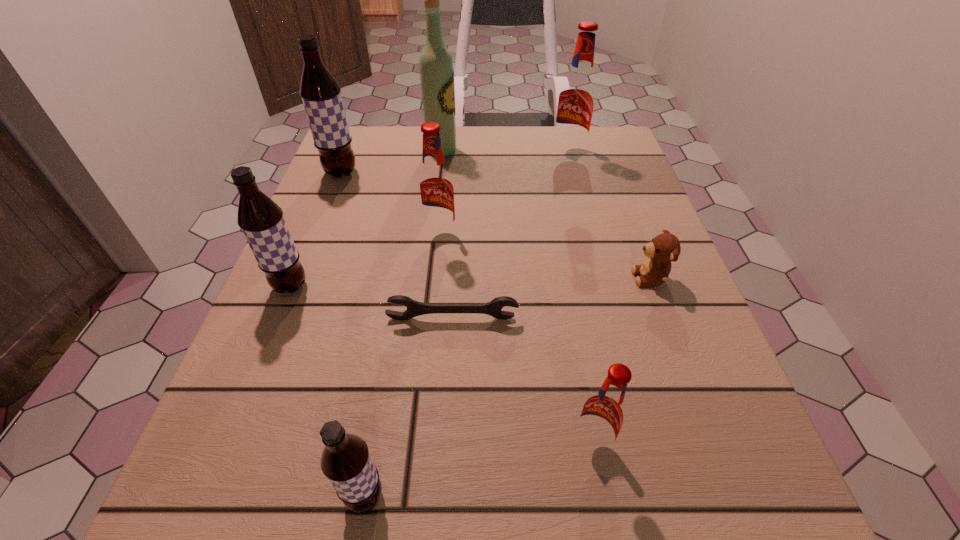
Find the location of a particular element. free space that is in between the biggest brown root beer and the smallest brown root beer is located at coordinates (353, 334).

At what (x,y) coordinates should I click in order to perform the action: click on vacant space in between the white wine bottle and the fifth nearest root beer. Please return your answer as a coordinate pair (x, y). This screenshot has height=540, width=960. Looking at the image, I should click on (392, 162).

Locate an element on the screen. The width and height of the screenshot is (960, 540). free space between the second nearest red root beer and the teddy bear is located at coordinates (544, 257).

Where is `vacant area that lies between the farthest root beer and the farthest brown root beer`? vacant area that lies between the farthest root beer and the farthest brown root beer is located at coordinates (455, 163).

I want to click on vacant area that lies between the third root beer from left to right and the biggest red root beer, so click(467, 325).

I want to click on free spot between the smallest red root beer and the white wine bottle, so tap(516, 298).

Identify the location of blank region between the second shortest object and the wrench. (551, 298).

Locate an element on the screen. The width and height of the screenshot is (960, 540). free area in between the fourth root beer from left to right and the brown teddy bear is located at coordinates click(x=544, y=257).

What are the coordinates of `blank region between the biggest brown root beer and the third nearest root beer` in the screenshot? It's located at (316, 230).

Locate an element on the screen. object that can be found as the eighth closest to the leftmost red root beer is located at coordinates (346, 462).